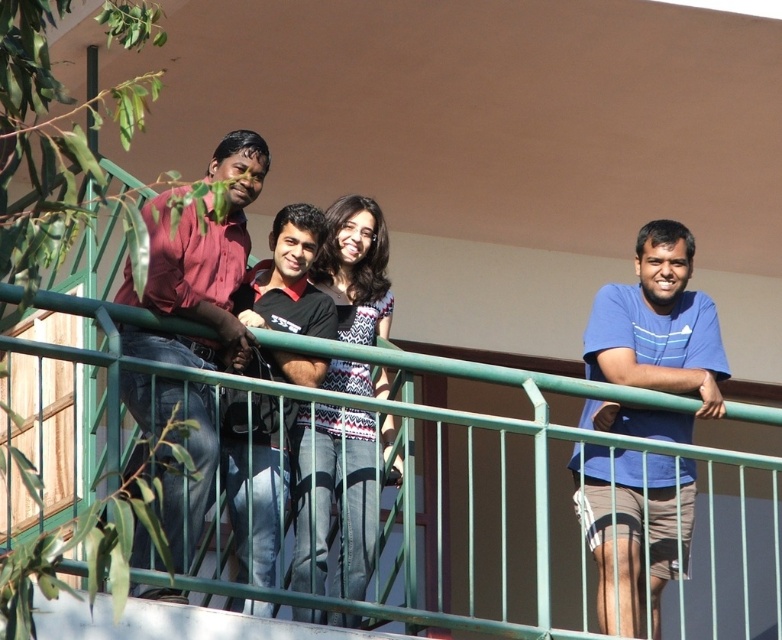
Question: Which of the following is the closest to the observer?

Choices:
 (A) (371, 582)
 (B) (242, 570)
 (C) (655, 268)

Answer: (B)

Question: Is matte red shirt at left below black cotton shirt at center?

Choices:
 (A) yes
 (B) no

Answer: (B)

Question: Which object is the closest to the black cotton shirt at center?

Choices:
 (A) blue cotton shirt at right
 (B) green metal railing at center

Answer: (B)

Question: Is matte red shirt at left further to camera compared to black cotton shirt at center?

Choices:
 (A) no
 (B) yes

Answer: (A)

Question: Can you confirm if green metal railing at center is smaller than black cotton shirt at center?

Choices:
 (A) no
 (B) yes

Answer: (A)

Question: Which of the following is the closest to the observer?

Choices:
 (A) (135, 586)
 (B) (404, 490)
 (C) (633, 480)

Answer: (A)